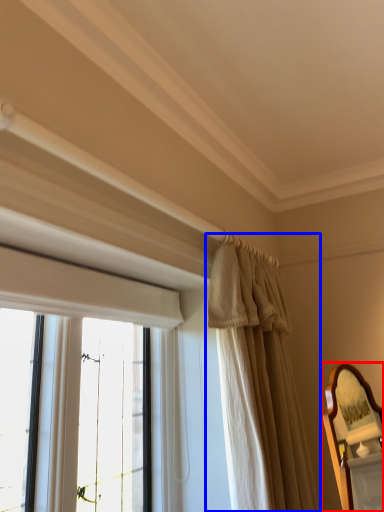
Question: Which object appears closest to the camera in this image, mirror (highlighted by a red box) or curtain (highlighted by a blue box)?

Choices:
 (A) mirror
 (B) curtain

Answer: (A)